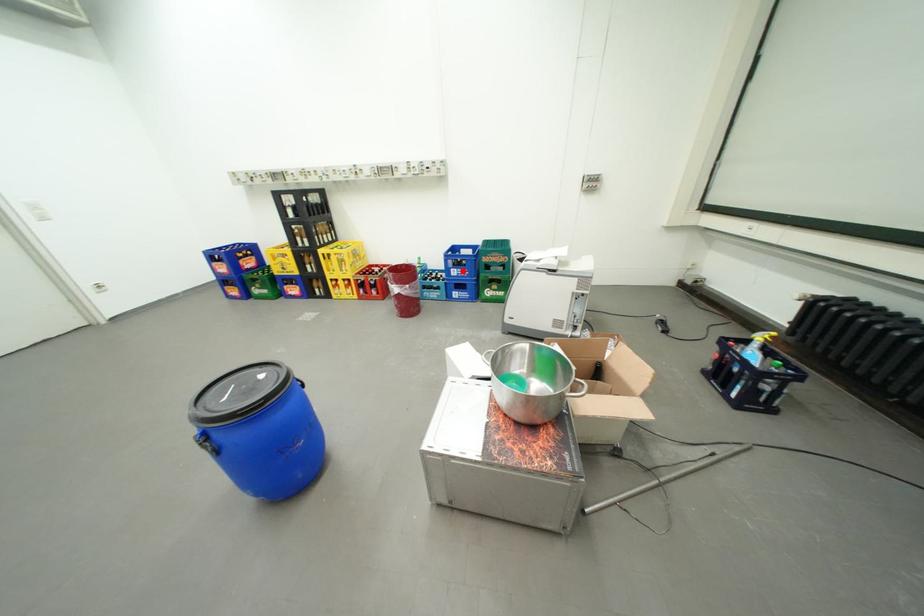
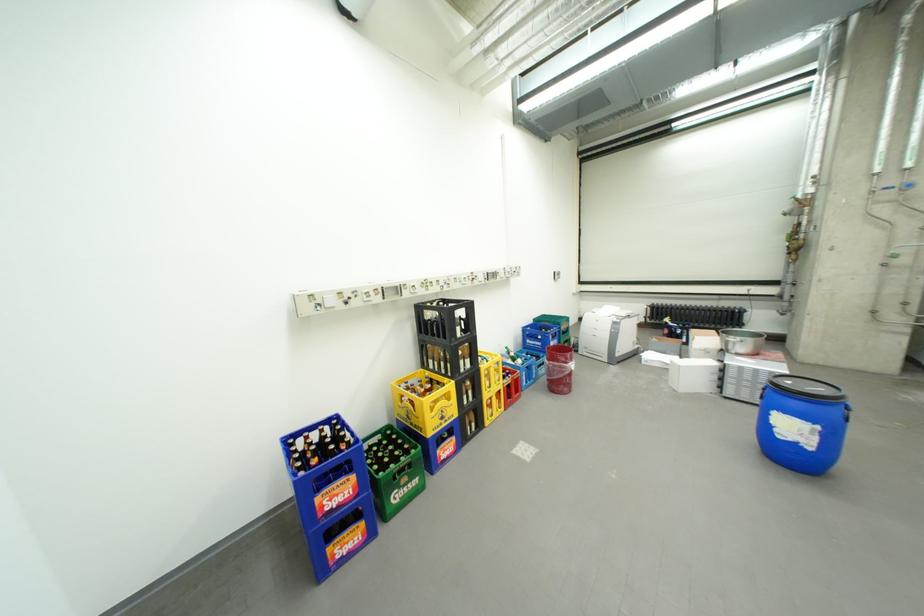
Question: I am providing you with two images of the same scene from different viewpoints. In image1, a red point is highlighted. Considering the same 3D point in image2, which of the following is correct?

Choices:
 (A) It is closer
 (B) It is farther

Answer: (B)